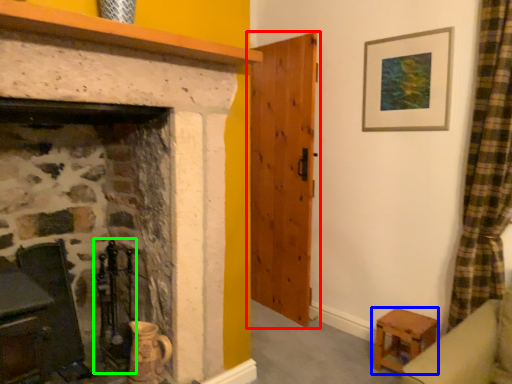
Question: Based on their relative distances, which object is farther from door (highlighted by a red box)? Choose from stool (highlighted by a blue box) and chair (highlighted by a green box).

Choices:
 (A) stool
 (B) chair

Answer: (B)